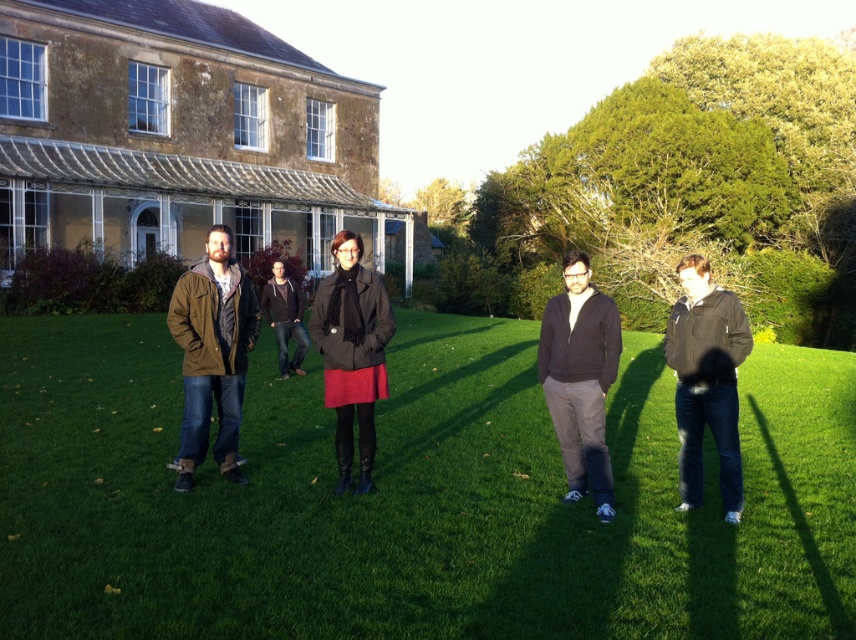
Based on the photo, you are a photographer trying to capture a group photo of the matte brown jacket at left and the matte black coat at center. Which of these two clothing items will appear taller in the photo?

The matte black coat at center appears taller in the photo because it is taller than the matte brown jacket at left.

You are a photographer trying to capture a group photo of the matte brown jacket at left and the dark gray sweater at center. Since you want to ensure both subjects are in focus, you need to know which one is closer to the camera. Can you determine which one is closer?

The matte brown jacket at left is taller than the dark gray sweater at center, which suggests it is closer to the camera. Therefore, the matte brown jacket at left is closer to the camera.

You are taking a photo of the group standing in front of the old stone building. The matte brown jacket at left and the dark gray sweater at center are both in the frame. Which one is positioned lower in the image?

The matte brown jacket at left is positioned lower than the dark gray sweater at center in the image.